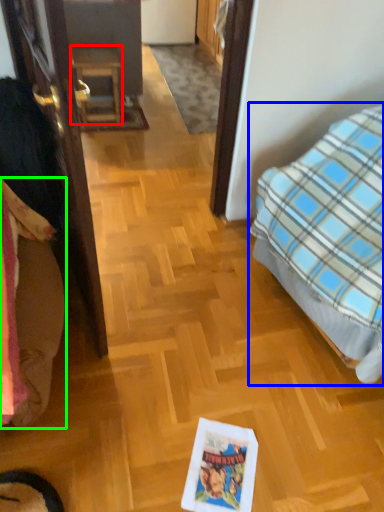
Question: Which object is the farthest from furniture (highlighted by a red box)? Choose among these: bed (highlighted by a blue box) or bedding (highlighted by a green box).

Choices:
 (A) bed
 (B) bedding

Answer: (B)